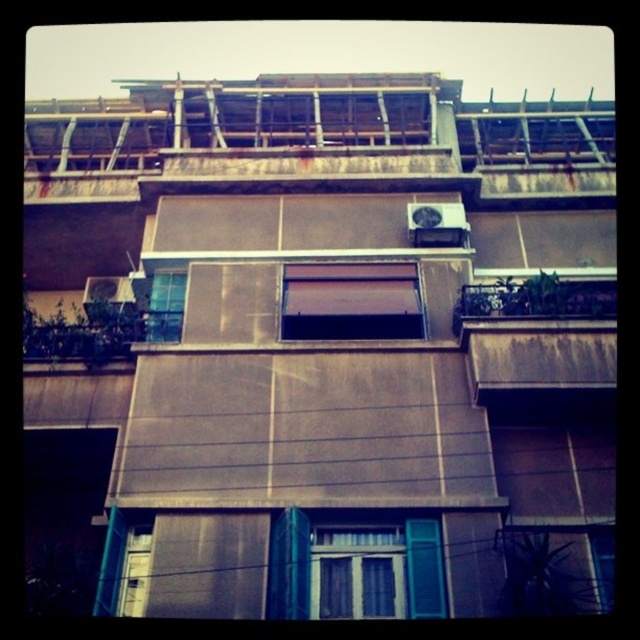
Question: Can you confirm if brown matte awning at center is wider than clear glass window at center?

Choices:
 (A) no
 (B) yes

Answer: (A)

Question: Among these points, which one is nearest to the camera?

Choices:
 (A) (305, 572)
 (B) (454, 330)
 (C) (152, 324)
 (D) (416, 301)

Answer: (A)

Question: Estimate the real-world distances between objects in this image. Which object is closer to the brown matte awning at center?

Choices:
 (A) brown wooden balcony at right
 (B) clear glass window at center
 (C) wooden shuttered window at center

Answer: (A)

Question: Which point is closer to the camera?

Choices:
 (A) brown matte awning at center
 (B) wooden shuttered window at center
 (C) brown wooden balcony at right

Answer: (B)

Question: Does brown matte awning at center come in front of clear glass window at center?

Choices:
 (A) no
 (B) yes

Answer: (B)

Question: From the image, what is the correct spatial relationship of wooden shuttered window at center in relation to brown wooden balcony at right?

Choices:
 (A) right
 (B) left

Answer: (B)